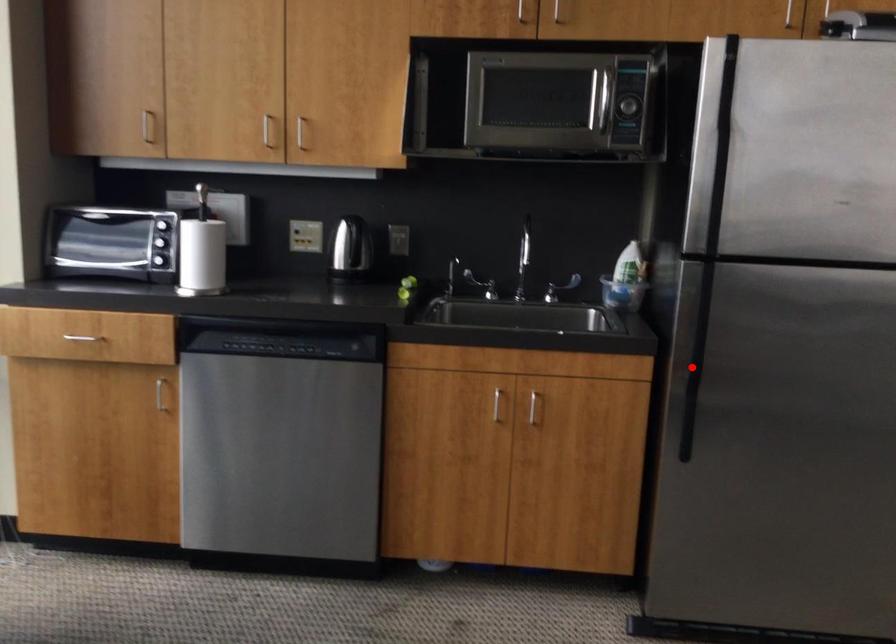
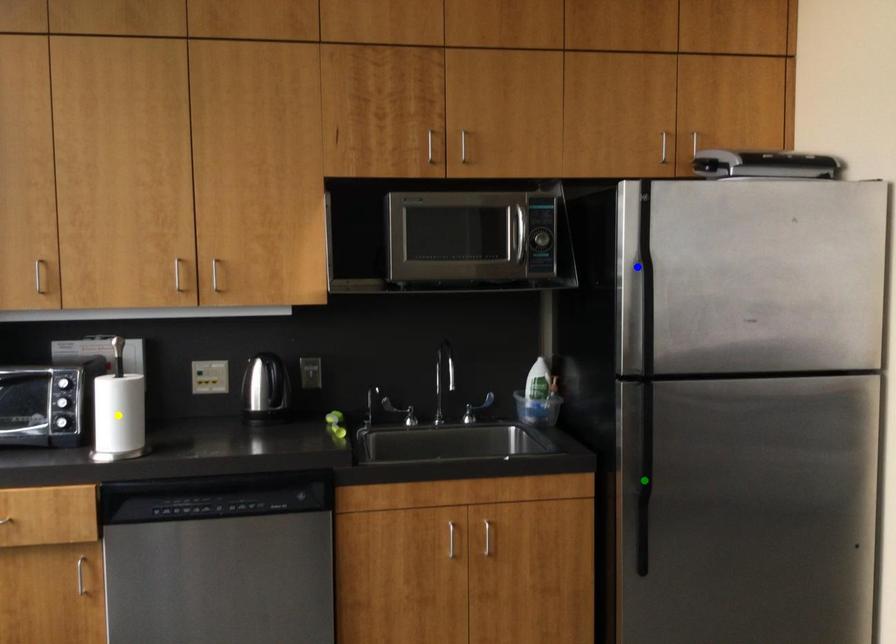
Question: I am providing you with two images of the same scene from different viewpoints. A red point is marked on the first image. You are given multiple points on the second image. Which mark in image 2 goes with the point in image 1?

Choices:
 (A) yellow point
 (B) blue point
 (C) green point

Answer: (C)